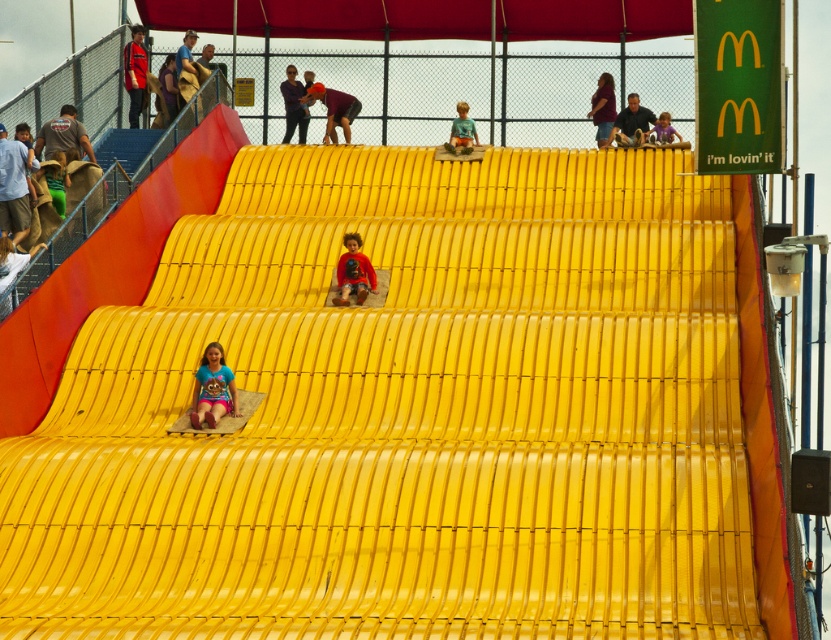
Question: Which point is farther from the camera taking this photo?

Choices:
 (A) (353, 262)
 (B) (130, 100)
 (C) (470, 124)

Answer: (B)

Question: In this image, where is matte brown shirt at upper left located relative to matte purple shirt at upper center?

Choices:
 (A) above
 (B) below

Answer: (B)

Question: Which of the following is the farthest from the observer?

Choices:
 (A) matte brown shirt at upper left
 (B) matte yellow slide at center

Answer: (A)

Question: Observing the image, what is the correct spatial positioning of matte blue t-shirt at center in reference to matte purple shirt at upper center?

Choices:
 (A) right
 (B) left

Answer: (B)

Question: Which of the following is the closest to the observer?

Choices:
 (A) (677, 138)
 (B) (451, 140)

Answer: (B)

Question: Is green matte shirt at upper center closer to camera compared to matte yellow slide at upper center?

Choices:
 (A) yes
 (B) no

Answer: (B)